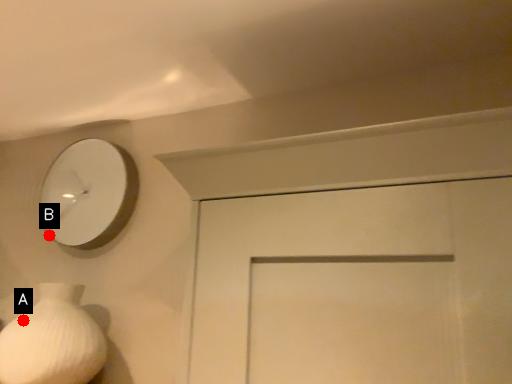
Question: Two points are circled on the image, labeled by A and B beside each circle. Which of the following is the closest to the observer?

Choices:
 (A) A is closer
 (B) B is closer

Answer: (A)